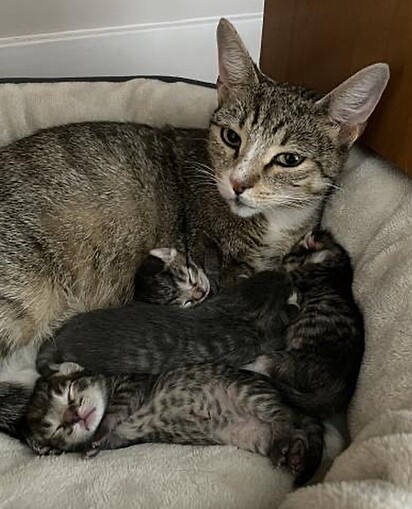
I want to click on cat bed, so click(x=127, y=104), click(x=358, y=199), click(x=364, y=502), click(x=332, y=442), click(x=255, y=364), click(x=18, y=364), click(x=15, y=468).